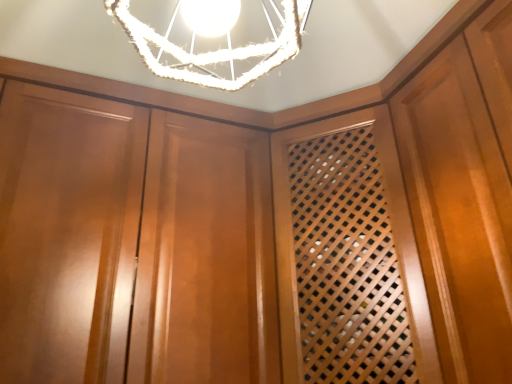
Question: Considering the relative positions of glossy wood cabinetry at center and white textured lampshade at upper center in the image provided, is glossy wood cabinetry at center to the right of white textured lampshade at upper center from the viewer's perspective?

Choices:
 (A) no
 (B) yes

Answer: (A)

Question: From the image's perspective, does glossy wood cabinetry at center appear lower than white textured lampshade at upper center?

Choices:
 (A) no
 (B) yes

Answer: (B)

Question: Is glossy wood cabinetry at center further to the viewer compared to white textured lampshade at upper center?

Choices:
 (A) no
 (B) yes

Answer: (B)

Question: Considering the relative sizes of glossy wood cabinetry at center and white textured lampshade at upper center in the image provided, is glossy wood cabinetry at center thinner than white textured lampshade at upper center?

Choices:
 (A) yes
 (B) no

Answer: (B)

Question: Is white textured lampshade at upper center located within glossy wood cabinetry at center?

Choices:
 (A) yes
 (B) no

Answer: (B)

Question: Does glossy wood cabinetry at center have a greater width compared to white textured lampshade at upper center?

Choices:
 (A) no
 (B) yes

Answer: (B)

Question: Does white textured lampshade at upper center have a smaller size compared to glossy wood cabinetry at center?

Choices:
 (A) no
 (B) yes

Answer: (B)

Question: Can you confirm if white textured lampshade at upper center is positioned to the right of glossy wood cabinetry at center?

Choices:
 (A) yes
 (B) no

Answer: (A)

Question: Is white textured lampshade at upper center further to the viewer compared to glossy wood cabinetry at center?

Choices:
 (A) yes
 (B) no

Answer: (B)

Question: Considering the relative sizes of white textured lampshade at upper center and glossy wood cabinetry at center in the image provided, is white textured lampshade at upper center shorter than glossy wood cabinetry at center?

Choices:
 (A) no
 (B) yes

Answer: (B)

Question: Is white textured lampshade at upper center not near glossy wood cabinetry at center?

Choices:
 (A) yes
 (B) no

Answer: (B)

Question: From the image's perspective, is white textured lampshade at upper center above glossy wood cabinetry at center?

Choices:
 (A) no
 (B) yes

Answer: (B)

Question: Which is correct: glossy wood cabinetry at center is inside white textured lampshade at upper center, or outside of it?

Choices:
 (A) inside
 (B) outside

Answer: (B)